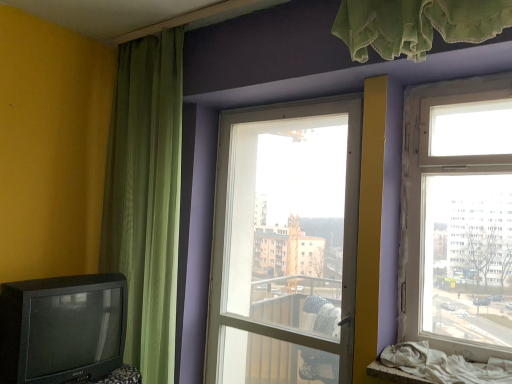
Question: From a real-world perspective, is matte black television at lower left positioned over clear glass window at upper right, the first window from the right, based on gravity?

Choices:
 (A) yes
 (B) no

Answer: (B)

Question: From a real-world perspective, is matte black television at lower left positioned under clear glass window at upper right, positioned as the second window in left-to-right order, based on gravity?

Choices:
 (A) no
 (B) yes

Answer: (B)

Question: Would you consider matte black television at lower left to be distant from clear glass window at upper right, the first window from the right?

Choices:
 (A) no
 (B) yes

Answer: (B)

Question: Are matte black television at lower left and clear glass window at upper right, the second window positioned from the back, beside each other?

Choices:
 (A) no
 (B) yes

Answer: (A)

Question: Can you confirm if matte black television at lower left is positioned to the left of clear glass window at upper right, the second window positioned from the back?

Choices:
 (A) no
 (B) yes

Answer: (B)

Question: Considering the positions of point (169, 297) and point (333, 137), is point (169, 297) closer or farther from the camera than point (333, 137)?

Choices:
 (A) closer
 (B) farther

Answer: (A)

Question: In terms of width, does green sheer curtain at left look wider or thinner when compared to transparent glass door at center, the first window viewed from the left?

Choices:
 (A) thin
 (B) wide

Answer: (B)

Question: From their relative heights in the image, would you say green sheer curtain at left is taller or shorter than transparent glass door at center, which is the second window from front to back?

Choices:
 (A) short
 (B) tall

Answer: (B)

Question: From a real-world perspective, is green sheer curtain at left positioned above or below transparent glass door at center, the first window viewed from the left?

Choices:
 (A) above
 (B) below

Answer: (A)

Question: Considering the positions of clear glass window at upper right, the first window from the right, and transparent glass door at center, which is the second window from front to back, in the image, is clear glass window at upper right, the first window from the right, taller or shorter than transparent glass door at center, which is the second window from front to back,?

Choices:
 (A) short
 (B) tall

Answer: (A)

Question: From a real-world perspective, relative to transparent glass door at center, which is the second window from front to back, is clear glass window at upper right, the first window from the right, vertically above or below?

Choices:
 (A) below
 (B) above

Answer: (B)

Question: Considering the relative positions of clear glass window at upper right, which is counted as the first window, starting from the front, and transparent glass door at center, the 1th window in the back-to-front sequence, in the image provided, is clear glass window at upper right, which is counted as the first window, starting from the front, to the left or to the right of transparent glass door at center, the 1th window in the back-to-front sequence,?

Choices:
 (A) right
 (B) left

Answer: (A)

Question: Relative to transparent glass door at center, which is the second window from front to back, is clear glass window at upper right, positioned as the second window in left-to-right order, in front or behind?

Choices:
 (A) behind
 (B) front

Answer: (B)

Question: From their relative heights in the image, would you say matte black television at lower left is taller or shorter than transparent glass door at center, the first window viewed from the left?

Choices:
 (A) short
 (B) tall

Answer: (A)

Question: From the image's perspective, is matte black television at lower left above or below transparent glass door at center, the first window viewed from the left?

Choices:
 (A) above
 (B) below

Answer: (B)